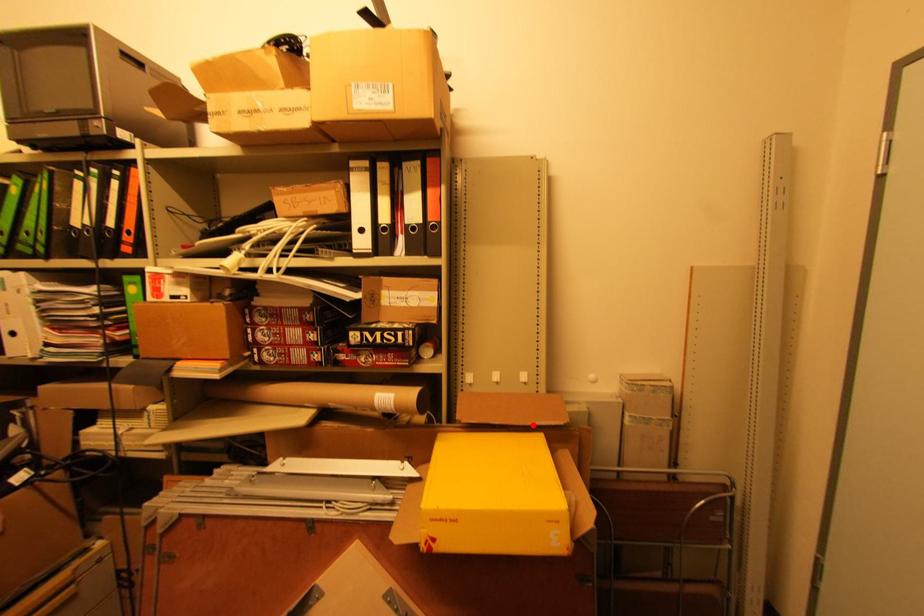
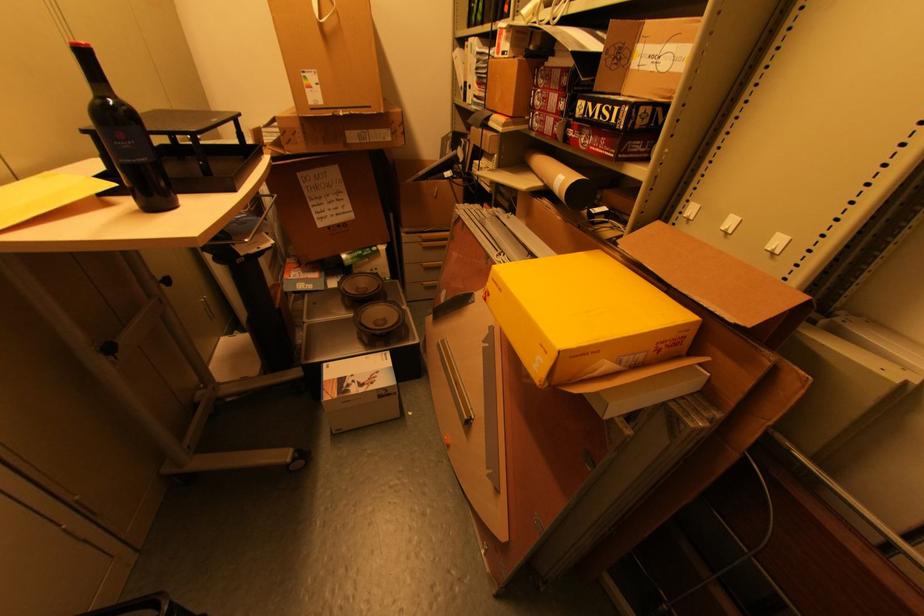
Locate, in the second image, the point that corresponds to the highlighted location in the first image.

(688, 294)